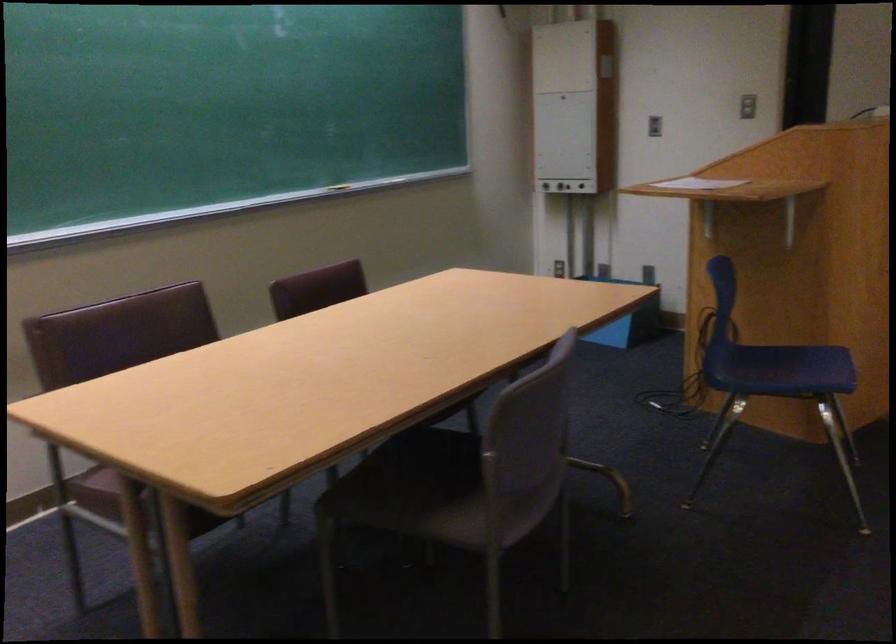
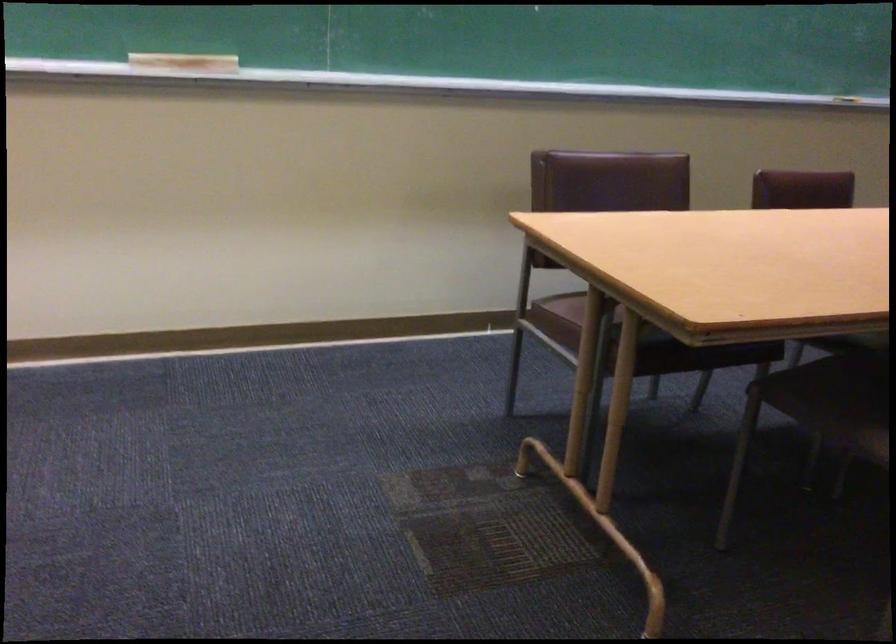
The point at (403, 485) is marked in the first image. Where is the corresponding point in the second image?

(833, 391)